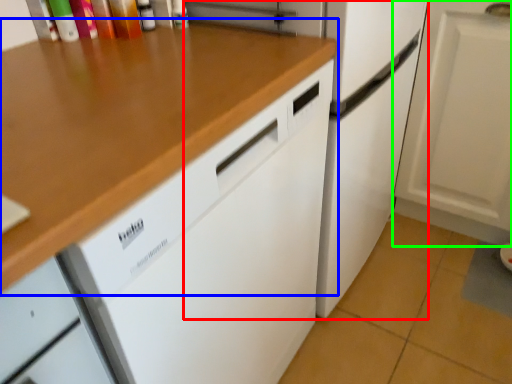
Question: Which is nearer to the refrigerator (highlighted by a red box)? countertop (highlighted by a blue box) or cabinetry (highlighted by a green box).

Choices:
 (A) countertop
 (B) cabinetry

Answer: (B)